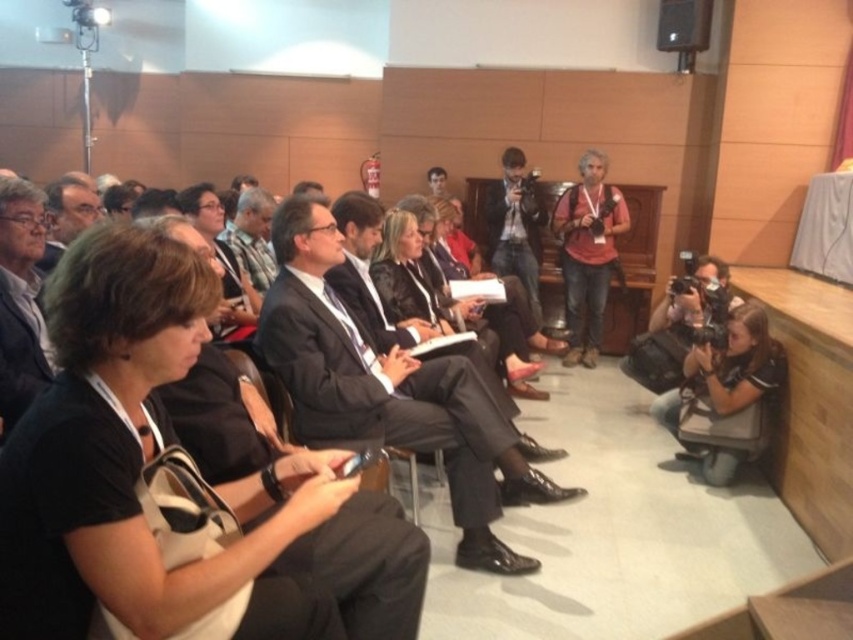
You are organizing a photo shoot and need to ensure that the matte black camera at center can be clearly seen in the frame without being blocked by the dark gray suit at center. Given their sizes, is this possible?

The dark gray suit at center is bigger than the matte black camera at center, so there is a higher chance the camera could be blocked if positioned behind the suit. To ensure visibility, place the camera in front of the suit or adjust their positions so the camera isn not obscured.

You are sitting in the conference room and want to reach both the point at coordinates (x=502, y=436) and the point at coordinates (x=496, y=224). Which point is closer to you?

The point at coordinates (x=502, y=436) is closer to you than the point at coordinates (x=496, y=224).